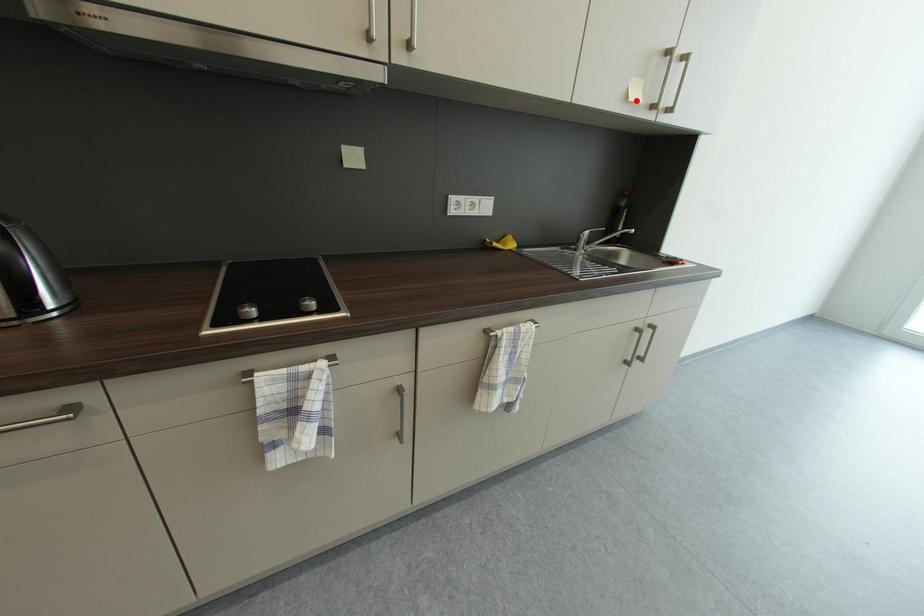
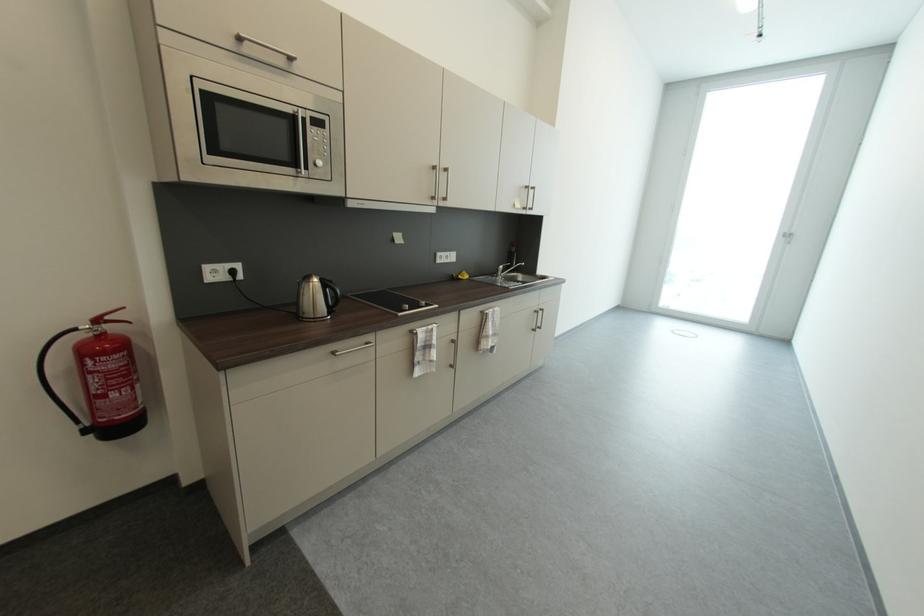
Question: I am providing you with two images of the same scene from different viewpoints. Image1 has a red point marked. In image2, the corresponding 3D location appears at what relative position? Reply with the corresponding letter.

Choices:
 (A) Closer
 (B) Farther

Answer: (A)